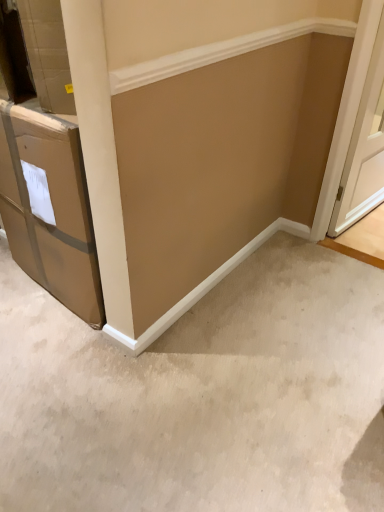
Describe the element at coordinates (202, 395) in the screenshot. I see `beige carpet at lower center` at that location.

Locate an element on the screen. beige carpet at lower center is located at coordinates (202, 395).

Measure the distance between white wood door at right and camera.

white wood door at right is 1.61 meters away from camera.

Find the location of a particular element. white wood door at right is located at coordinates (364, 149).

Describe the element at coordinates (364, 149) in the screenshot. The image size is (384, 512). I see `white wood door at right` at that location.

Identify the location of beige carpet at lower center. The image size is (384, 512). (202, 395).

Is white wood door at right to the right of beige carpet at lower center from the viewer's perspective?

Indeed, white wood door at right is positioned on the right side of beige carpet at lower center.

Is white wood door at right in front of or behind beige carpet at lower center in the image?

white wood door at right is positioned farther from the viewer than beige carpet at lower center.

Is point (362, 111) less distant than point (168, 462)?

No.

Looking at this image, from the image's perspective, between white wood door at right and beige carpet at lower center, who is located below?

From the image's view, beige carpet at lower center is below.

Based on the photo, from a real-world perspective, is white wood door at right positioned above or below beige carpet at lower center?

white wood door at right is situated higher than beige carpet at lower center in the real world.

Which of these two, white wood door at right or beige carpet at lower center, is wider?

beige carpet at lower center is wider.

From their relative heights in the image, would you say white wood door at right is taller or shorter than beige carpet at lower center?

In the image, white wood door at right appears to be taller than beige carpet at lower center.

In terms of size, does white wood door at right appear bigger or smaller than beige carpet at lower center?

Clearly, white wood door at right is larger in size than beige carpet at lower center.

Is beige carpet at lower center a part of white wood door at right?

Actually, beige carpet at lower center is outside white wood door at right.

Is white wood door at right not close to beige carpet at lower center?

Yes, white wood door at right and beige carpet at lower center are quite far apart.

Is white wood door at right oriented away from beige carpet at lower center?

No, beige carpet at lower center is not at the back of white wood door at right.

Can you tell me how much white wood door at right and beige carpet at lower center differ in facing direction?

173 degrees separate the facing orientations of white wood door at right and beige carpet at lower center.

Find the location of a particular element. This screenshot has height=512, width=384. door on the right of beige carpet at lower center is located at coordinates (364, 149).

Considering the positions of objects beige carpet at lower center and white wood door at right in the image provided, who is more to the right, beige carpet at lower center or white wood door at right?

From the viewer's perspective, white wood door at right appears more on the right side.

Which object is further away from the camera taking this photo, beige carpet at lower center or white wood door at right?

white wood door at right is behind.

Considering the points (131, 435) and (345, 213), which point is in front, point (131, 435) or point (345, 213)?

Point (131, 435)

From the image's perspective, which object appears higher, beige carpet at lower center or white wood door at right?

white wood door at right.

From a real-world perspective, does beige carpet at lower center sit lower than white wood door at right?

Yes, from a real-world perspective, beige carpet at lower center is beneath white wood door at right.

Does beige carpet at lower center have a greater width compared to white wood door at right?

Indeed, beige carpet at lower center has a greater width compared to white wood door at right.

Is beige carpet at lower center taller or shorter than white wood door at right?

beige carpet at lower center is shorter than white wood door at right.

Considering the sizes of objects beige carpet at lower center and white wood door at right in the image provided, who is smaller, beige carpet at lower center or white wood door at right?

beige carpet at lower center is smaller.

Is white wood door at right inside beige carpet at lower center?

That's incorrect, white wood door at right is not inside beige carpet at lower center.

Can you see beige carpet at lower center touching white wood door at right?

beige carpet at lower center and white wood door at right are clearly separated.

Is beige carpet at lower center looking in the opposite direction of white wood door at right?

That's not correct — beige carpet at lower center is not looking away from white wood door at right.

How different are the orientations of beige carpet at lower center and white wood door at right in degrees?

173 degrees.

The image size is (384, 512). What are the coordinates of `door located on the right of beige carpet at lower center` in the screenshot? It's located at (364, 149).

The image size is (384, 512). I want to click on door that is above the beige carpet at lower center (from a real-world perspective), so click(x=364, y=149).

The width and height of the screenshot is (384, 512). I want to click on door behind the beige carpet at lower center, so click(x=364, y=149).